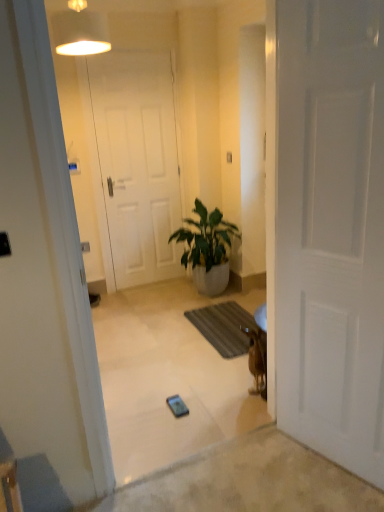
Locate an element on the screen. The height and width of the screenshot is (512, 384). free space in front of brown furry dog at right is located at coordinates (249, 412).